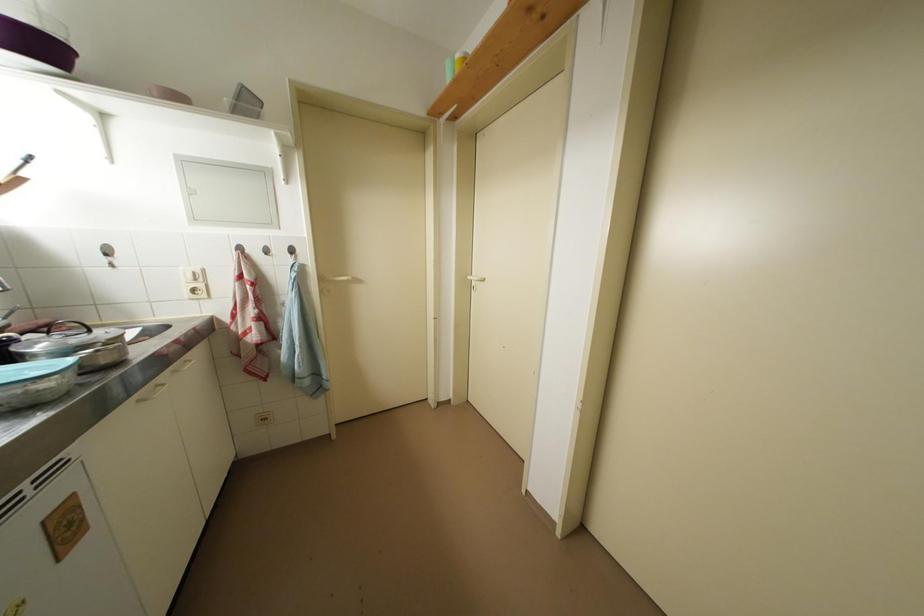
The location [35,45] corresponds to which object?

It refers to a purple bowl.